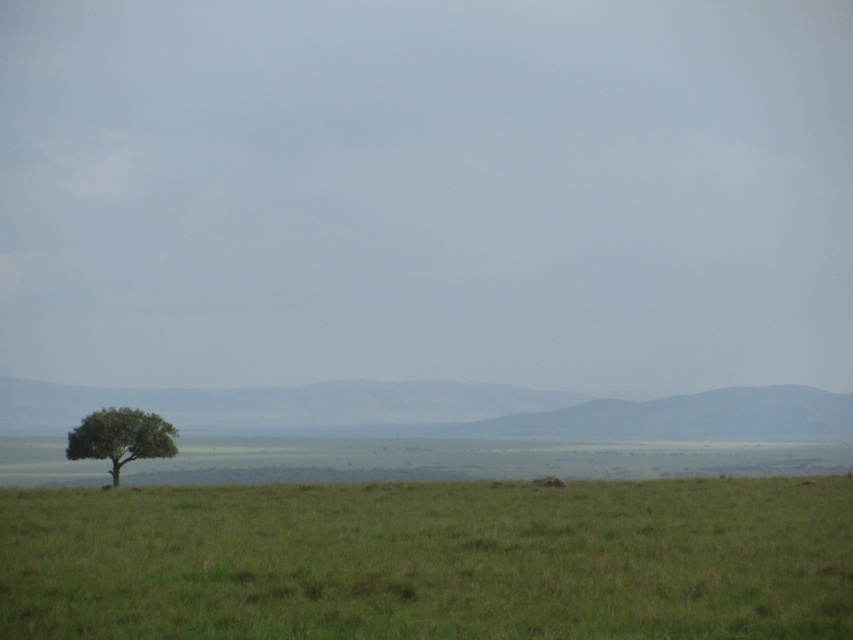
What is the spatial relationship between the green grassy plain at lower center and the green leafy tree at lower left in the savanna scene?

The green grassy plain at lower center is located to the right of the green leafy tree at lower left.

You are a hiker trying to cross the savanna. You have a map showing the green grassy plain at lower center and the green leafy tree at lower left. If you want to walk from the tree to the plain, which direction should you head?

The green leafy tree at lower left is to the left of the green grassy plain at lower center, so you should head to the right to reach the plain from the tree.